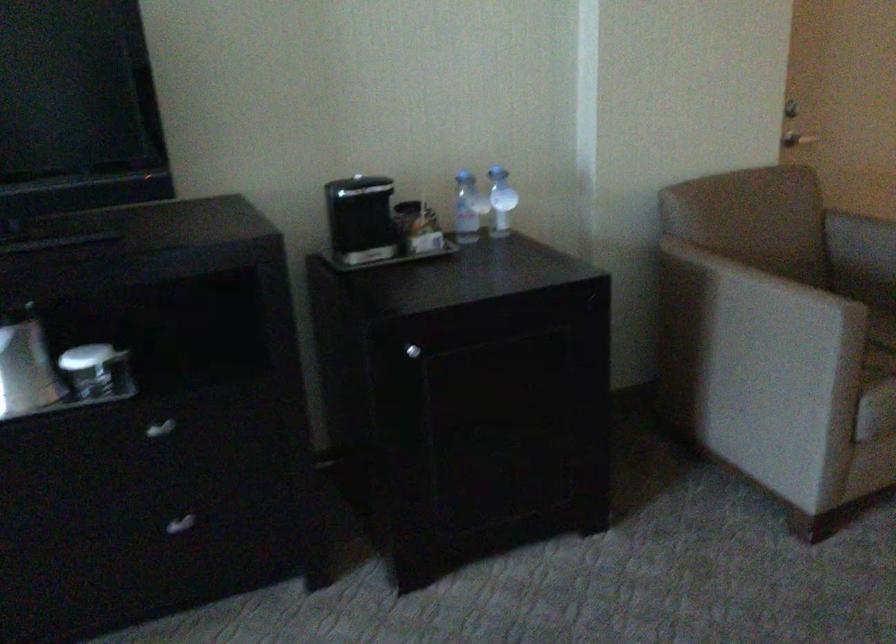
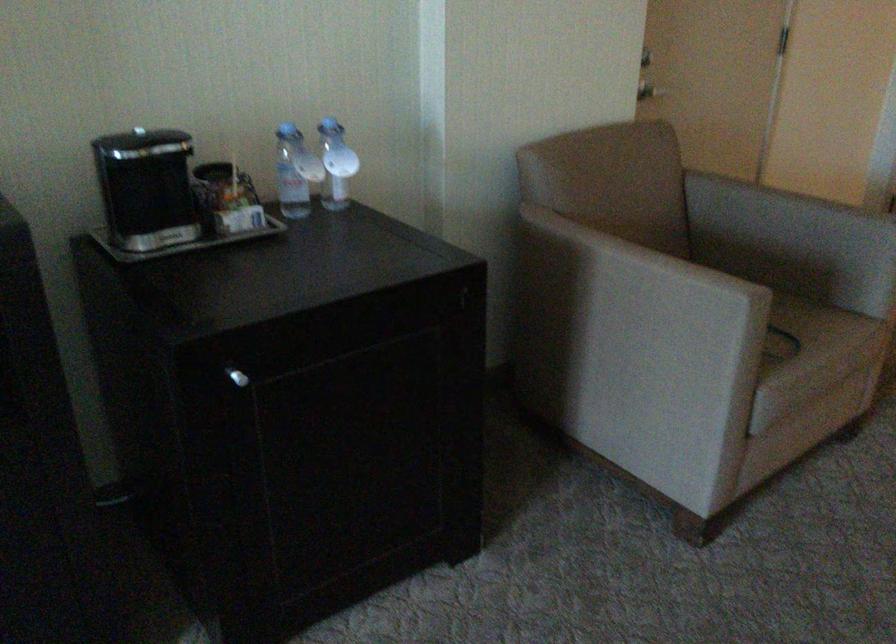
Locate, in the second image, the point that corresponds to (803,138) in the first image.

(649, 90)